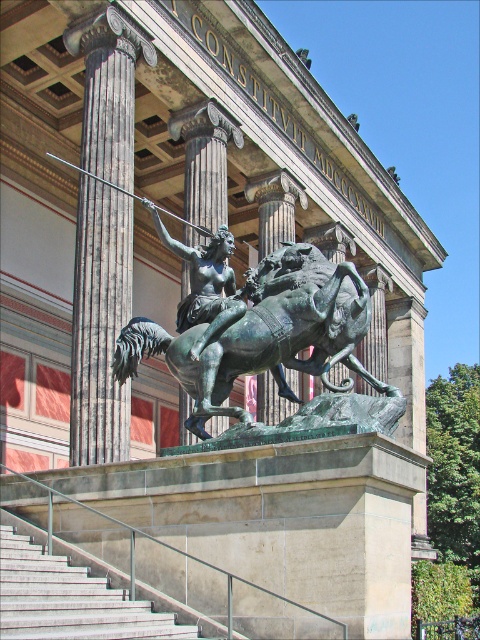
Question: Which of the following is the farthest from the observer?

Choices:
 (A) (108, 314)
 (B) (273, 368)
 (C) (217, 232)
 (D) (192, 625)

Answer: (A)

Question: Which point is farther from the camera taking this photo?

Choices:
 (A) (76, 333)
 (B) (334, 392)

Answer: (A)

Question: Is bronze/greenish patina horse at center bigger than bronze statue at center?

Choices:
 (A) yes
 (B) no

Answer: (A)

Question: Considering the real-world distances, which object is farthest from the bronze statue at center?

Choices:
 (A) gray concrete stairs at lower left
 (B) bronze column at center

Answer: (A)

Question: Is bronze/greenish patina horse at center positioned at the back of bronze statue at center?

Choices:
 (A) yes
 (B) no

Answer: (B)

Question: Is gray concrete stairs at lower left to the left of bronze statue at center from the viewer's perspective?

Choices:
 (A) yes
 (B) no

Answer: (A)